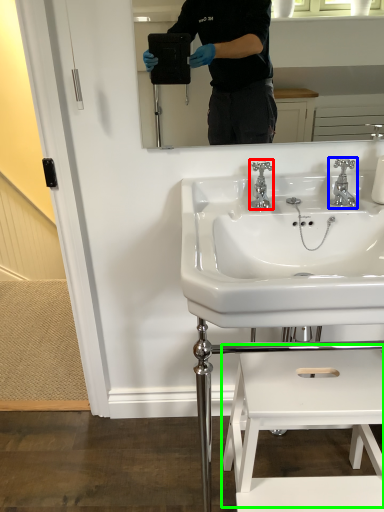
Question: Which object is the closest to the tap (highlighted by a red box)? Choose among these: tap (highlighted by a blue box) or step stool (highlighted by a green box).

Choices:
 (A) tap
 (B) step stool

Answer: (A)